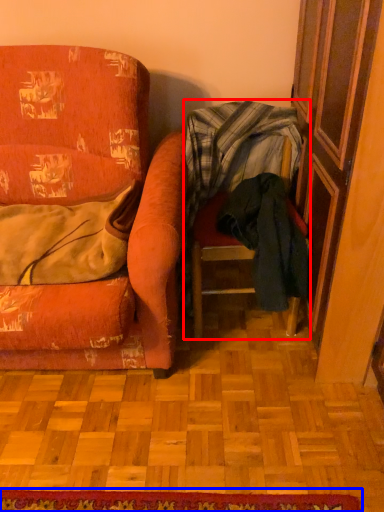
Question: Among these objects, which one is farthest to the camera, chair (highlighted by a red box) or doormat (highlighted by a blue box)?

Choices:
 (A) chair
 (B) doormat

Answer: (A)